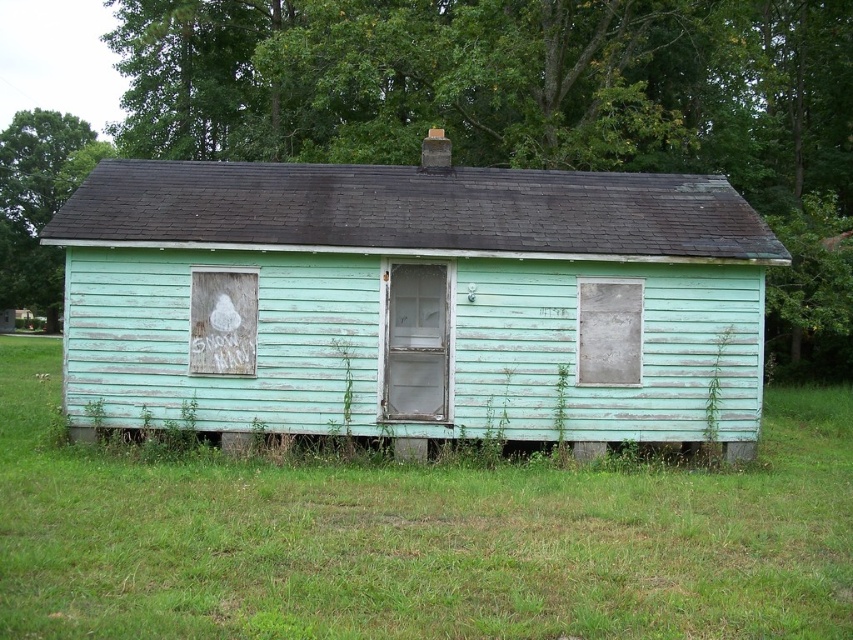
Question: Is transparent glass door at center wider than white chalkboard at left?

Choices:
 (A) yes
 (B) no

Answer: (B)

Question: Among these points, which one is nearest to the camera?

Choices:
 (A) click(x=387, y=301)
 (B) click(x=451, y=577)
 (C) click(x=233, y=358)
 (D) click(x=466, y=339)

Answer: (B)

Question: Which object is closer to the camera taking this photo?

Choices:
 (A) metallic gray door at center
 (B) green grass at lower center
 (C) transparent glass door at center
 (D) white chalkboard at left

Answer: (B)

Question: Which object appears closest to the camera in this image?

Choices:
 (A) transparent glass door at center
 (B) white chalkboard at left
 (C) green grass at lower center
 (D) metallic gray door at center

Answer: (C)

Question: Is white chalkboard at left further to the viewer compared to metallic gray door at center?

Choices:
 (A) no
 (B) yes

Answer: (A)

Question: Is transparent glass door at center thinner than metallic gray door at center?

Choices:
 (A) yes
 (B) no

Answer: (B)